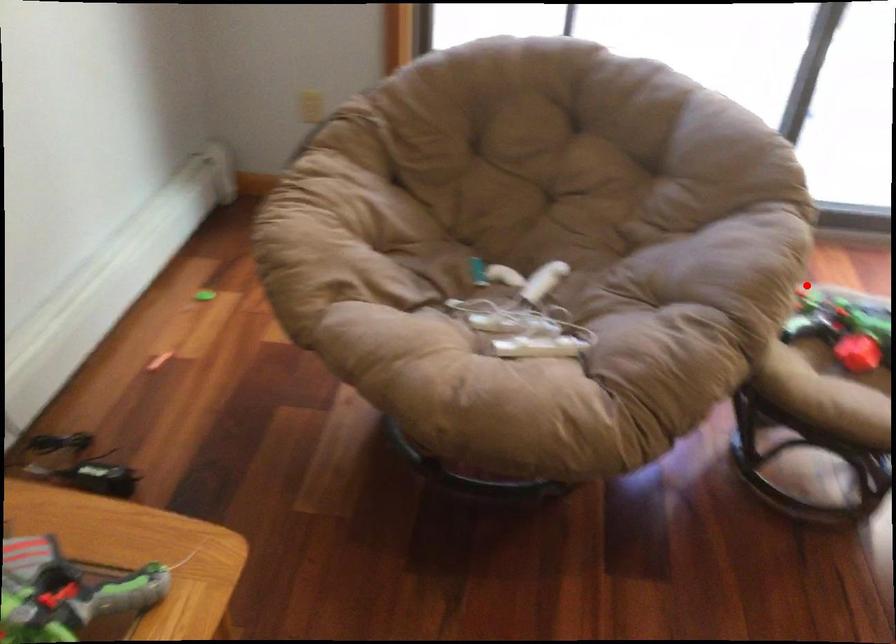
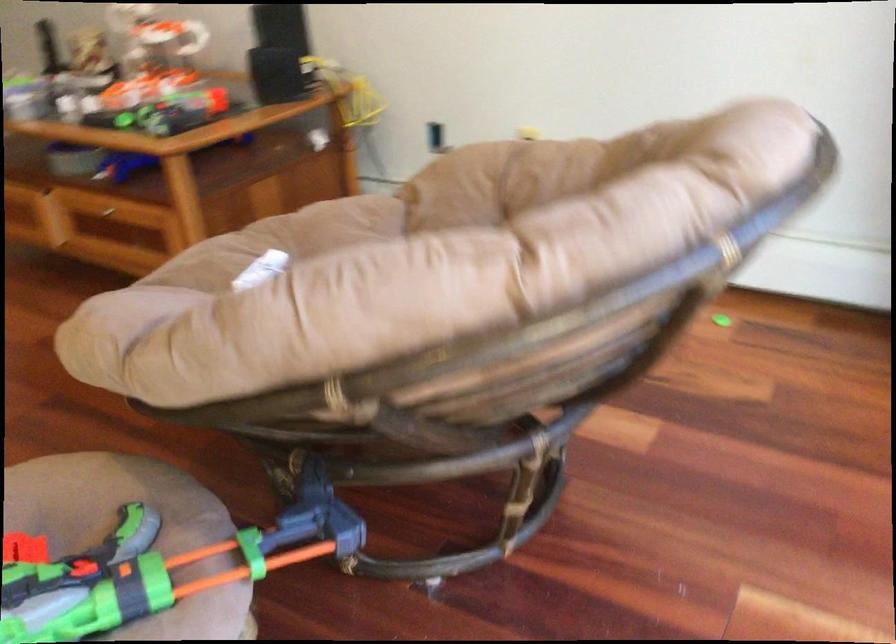
Question: I am providing you with two images of the same scene from different viewpoints. A red point is shown in image1. For the corresponding object point in image2, is it positioned nearer or farther from the camera?

Choices:
 (A) Nearer
 (B) Farther

Answer: (A)